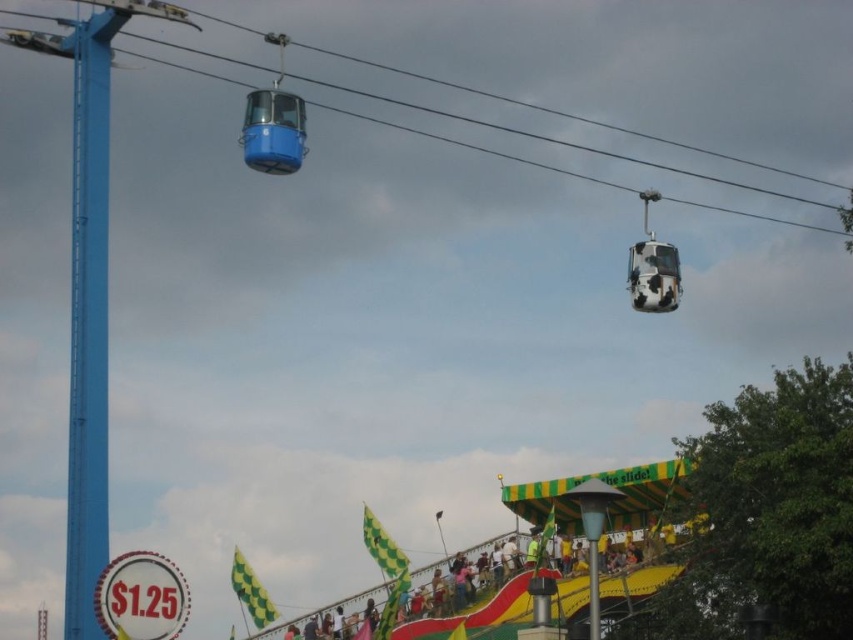
You are standing at the point marked as point (285, 163) in the image. There are two cable cars above you. If you want to catch the nearest one, which one should you look for?

The cable car that is closer to point (285, 163) is the one you should look for. Since the distance between them is 507.86 feet, you need to determine which one is nearer based on their positions relative to your location.